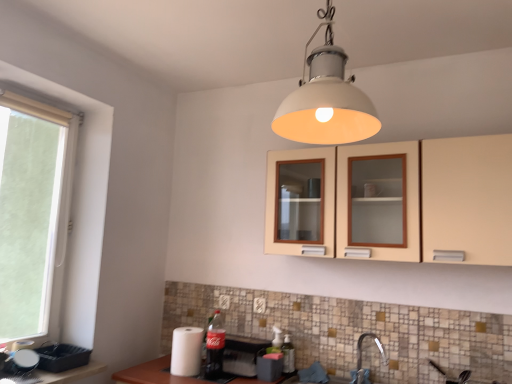
Question: Is white matte lampshade at upper center a part of white paper towel at lower left, which is counted as the 2th appliance, starting from the right?

Choices:
 (A) yes
 (B) no

Answer: (B)

Question: Considering the relative sizes of white paper towel at lower left, which is counted as the 2th appliance, starting from the right, and white matte lampshade at upper center in the image provided, is white paper towel at lower left, which is counted as the 2th appliance, starting from the right, smaller than white matte lampshade at upper center?

Choices:
 (A) yes
 (B) no

Answer: (A)

Question: Considering the relative positions of white paper towel at lower left, which is counted as the 2th appliance, starting from the right, and white matte lampshade at upper center in the image provided, is white paper towel at lower left, which is counted as the 2th appliance, starting from the right, to the right of white matte lampshade at upper center from the viewer's perspective?

Choices:
 (A) yes
 (B) no

Answer: (B)

Question: Can you confirm if white paper towel at lower left, positioned as the 2th appliance in left-to-right order, is shorter than white matte lampshade at upper center?

Choices:
 (A) yes
 (B) no

Answer: (A)

Question: From the image's perspective, is white paper towel at lower left, positioned as the 2th appliance in left-to-right order, on white matte lampshade at upper center?

Choices:
 (A) yes
 (B) no

Answer: (B)

Question: From a real-world perspective, relative to white paper towel at lower left, positioned as the 2th appliance in left-to-right order, is matte black toaster at lower center, arranged as the 1th appliance when viewed from the right, vertically above or below?

Choices:
 (A) below
 (B) above

Answer: (A)

Question: Relative to white paper towel at lower left, positioned as the 2th appliance in left-to-right order, is matte black toaster at lower center, arranged as the 1th appliance when viewed from the right, in front or behind?

Choices:
 (A) behind
 (B) front

Answer: (B)

Question: In terms of width, does matte black toaster at lower center, arranged as the 1th appliance when viewed from the right, look wider or thinner when compared to white paper towel at lower left, positioned as the 2th appliance in left-to-right order?

Choices:
 (A) thin
 (B) wide

Answer: (A)

Question: Considering the positions of matte black toaster at lower center, the 3th appliance from the left, and white paper towel at lower left, which is counted as the 2th appliance, starting from the right, in the image, is matte black toaster at lower center, the 3th appliance from the left, taller or shorter than white paper towel at lower left, which is counted as the 2th appliance, starting from the right,?

Choices:
 (A) short
 (B) tall

Answer: (A)

Question: From a real-world perspective, is white plastic window at left physically located above or below white plastic electric outlet at lower center, acting as the first electric outlet starting from the back?

Choices:
 (A) above
 (B) below

Answer: (A)

Question: From the image's perspective, is white plastic window at left located above or below white plastic electric outlet at lower center, which ranks as the first electric outlet in left-to-right order?

Choices:
 (A) above
 (B) below

Answer: (A)

Question: Is white plastic window at left in front of or behind white plastic electric outlet at lower center, which appears as the second electric outlet when viewed from the right, in the image?

Choices:
 (A) front
 (B) behind

Answer: (A)

Question: Which is correct: white plastic window at left is inside white plastic electric outlet at lower center, placed as the 2th electric outlet when sorted from front to back, or outside of it?

Choices:
 (A) outside
 (B) inside

Answer: (A)

Question: Based on their sizes in the image, would you say translucent plastic bottle at lower center, which ranks as the 2th bottle in left-to-right order, is bigger or smaller than white plastic window at left?

Choices:
 (A) big
 (B) small

Answer: (B)

Question: Considering the positions of point (287, 344) and point (58, 183), is point (287, 344) closer or farther from the camera than point (58, 183)?

Choices:
 (A) closer
 (B) farther

Answer: (A)